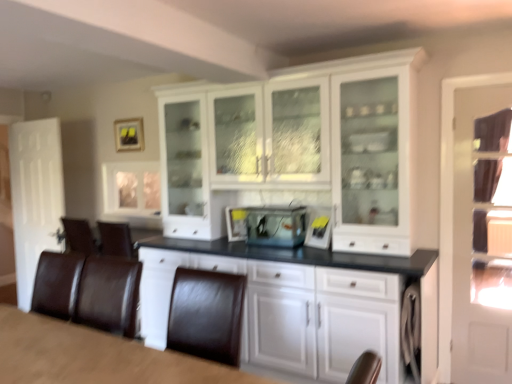
Question: Are clear glass cabinet at upper left and matte black picture frame at upper center far apart?

Choices:
 (A) yes
 (B) no

Answer: (B)

Question: Is clear glass cabinet at upper left facing away from matte black picture frame at upper center?

Choices:
 (A) no
 (B) yes

Answer: (A)

Question: Is the position of clear glass cabinet at upper left less distant than that of matte black picture frame at upper center?

Choices:
 (A) no
 (B) yes

Answer: (B)

Question: Considering the relative sizes of clear glass cabinet at upper left and matte black picture frame at upper center in the image provided, is clear glass cabinet at upper left taller than matte black picture frame at upper center?

Choices:
 (A) no
 (B) yes

Answer: (B)

Question: From the image's perspective, does clear glass cabinet at upper left appear higher than matte black picture frame at upper center?

Choices:
 (A) no
 (B) yes

Answer: (A)

Question: Is clear glass cabinet at upper left smaller than matte black picture frame at upper center?

Choices:
 (A) no
 (B) yes

Answer: (A)

Question: Is clear glass fish tank at center wider than clear glass cabinet at upper left?

Choices:
 (A) no
 (B) yes

Answer: (B)

Question: From the image's perspective, is clear glass fish tank at center on top of clear glass cabinet at upper left?

Choices:
 (A) no
 (B) yes

Answer: (A)

Question: Is the surface of clear glass fish tank at center in direct contact with clear glass cabinet at upper left?

Choices:
 (A) yes
 (B) no

Answer: (B)

Question: Does clear glass fish tank at center have a greater height compared to clear glass cabinet at upper left?

Choices:
 (A) yes
 (B) no

Answer: (B)

Question: Is clear glass fish tank at center completely or partially outside of clear glass cabinet at upper left?

Choices:
 (A) yes
 (B) no

Answer: (A)

Question: Would you consider clear glass fish tank at center to be distant from clear glass cabinet at upper left?

Choices:
 (A) no
 (B) yes

Answer: (B)

Question: Are matte black picture frame at upper center and clear glass fish tank at center making contact?

Choices:
 (A) yes
 (B) no

Answer: (B)